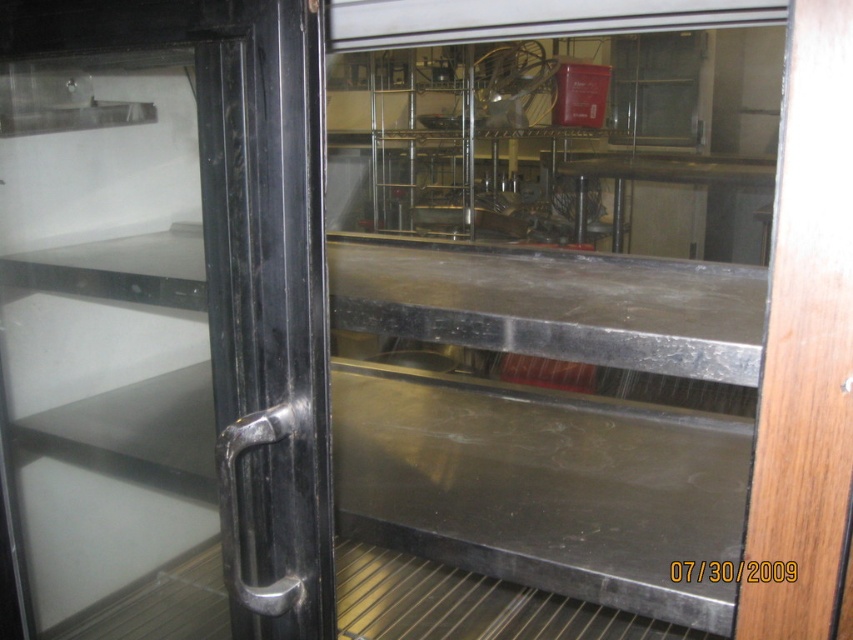
Question: Does transparent glass door at center have a lesser width compared to black metallic handle at left?

Choices:
 (A) no
 (B) yes

Answer: (A)

Question: Which of the following is the farthest from the observer?

Choices:
 (A) (624, 371)
 (B) (10, 625)

Answer: (A)

Question: Is transparent glass door at center thinner than black metallic handle at left?

Choices:
 (A) yes
 (B) no

Answer: (B)

Question: Which of the following is the closest to the observer?

Choices:
 (A) transparent glass door at center
 (B) black metallic handle at left

Answer: (B)

Question: Which of the following is the farthest from the observer?

Choices:
 (A) (639, 232)
 (B) (158, 449)

Answer: (A)

Question: Considering the relative positions of transparent glass door at center and black metallic handle at left in the image provided, where is transparent glass door at center located with respect to black metallic handle at left?

Choices:
 (A) below
 (B) above

Answer: (B)